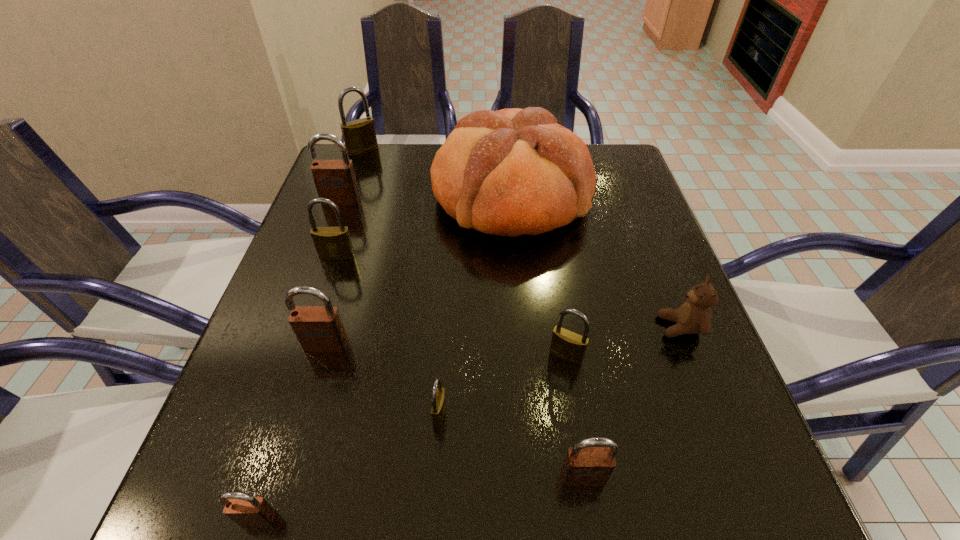
The image size is (960, 540). What are the coordinates of `the seventh farthest padlock` in the screenshot? It's located at (583, 466).

Locate an element on the screen. This screenshot has height=540, width=960. the rightmost brown padlock is located at coordinates (583, 466).

Image resolution: width=960 pixels, height=540 pixels. In order to click on teddy bear in this screenshot , I will do 694,316.

Where is `the third nearest padlock`? The height and width of the screenshot is (540, 960). the third nearest padlock is located at coordinates (438, 407).

At what (x,y) coordinates should I click in order to perform the action: click on the third brass padlock from left to right. Please return your answer as a coordinate pair (x, y). This screenshot has width=960, height=540. Looking at the image, I should click on (438, 407).

Find the location of a particular element. the nearest brown padlock is located at coordinates (244, 509).

Identify the location of the smallest brown padlock. The height and width of the screenshot is (540, 960). (244, 509).

At what (x,y) coordinates should I click in order to perform the action: click on vacant space located 0.210m on the front of the bread. Please return your answer as a coordinate pair (x, y). Looking at the image, I should click on (521, 327).

At what (x,y) coordinates should I click in order to perform the action: click on free location located 0.310m on the front of the farthest brass padlock. Please return your answer as a coordinate pair (x, y). Looking at the image, I should click on (335, 228).

I want to click on vacant space located on the front-facing side of the seventh nearest padlock, so click(333, 221).